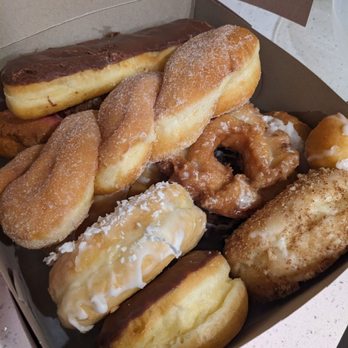
Where is `marble white surface`? Image resolution: width=348 pixels, height=348 pixels. marble white surface is located at coordinates (16, 333), (309, 330).